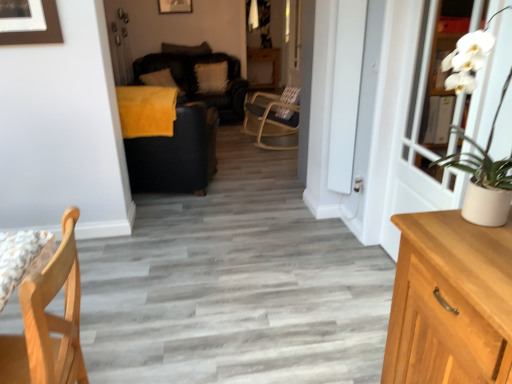
The width and height of the screenshot is (512, 384). Find the location of `white fluffy pillow at center, which is the first pillow in right-to-left order`. white fluffy pillow at center, which is the first pillow in right-to-left order is located at coordinates (211, 77).

Measure the distance between point (x=168, y=13) and camera.

Point (x=168, y=13) is 6.09 meters away from camera.

The image size is (512, 384). Find the location of `light wood chair at lower left`. light wood chair at lower left is located at coordinates (48, 321).

Find the location of `white wooden door at right`. white wooden door at right is located at coordinates (417, 148).

Where is `soft yellow pillow at upper center, placed as the 1th pillow when sorted from left to right`? soft yellow pillow at upper center, placed as the 1th pillow when sorted from left to right is located at coordinates point(161,80).

The image size is (512, 384). What do you see at coordinates (167, 140) in the screenshot?
I see `velvet black couch at center` at bounding box center [167, 140].

Image resolution: width=512 pixels, height=384 pixels. I want to click on white fluffy pillow at center, placed as the 3th pillow when sorted from left to right, so click(211, 77).

From a real-world perspective, is white wooden door at right above or below soft yellow pillow at upper center, placed as the 1th pillow when sorted from left to right?

From a real-world perspective, white wooden door at right is physically above soft yellow pillow at upper center, placed as the 1th pillow when sorted from left to right.

Considering the sizes of objects white wooden door at right and soft yellow pillow at upper center, the 3th pillow viewed from the right, in the image provided, who is smaller, white wooden door at right or soft yellow pillow at upper center, the 3th pillow viewed from the right,?

soft yellow pillow at upper center, the 3th pillow viewed from the right, is smaller.

From the picture: Is white wooden door at right facing away from soft yellow pillow at upper center, placed as the 1th pillow when sorted from left to right?

That's not correct — white wooden door at right is not looking away from soft yellow pillow at upper center, placed as the 1th pillow when sorted from left to right.

Is dark gray fabric pillow at upper center, the second pillow in the left-to-right sequence, outside of light wood chair at lower left?

Yes, dark gray fabric pillow at upper center, the second pillow in the left-to-right sequence, is located beyond the bounds of light wood chair at lower left.

Between dark gray fabric pillow at upper center, which appears as the second pillow when viewed from the right, and light wood chair at lower left, which one appears on the right side from the viewer's perspective?

From the viewer's perspective, light wood chair at lower left appears more on the right side.

Considering the points (186, 49) and (27, 344), which point is in front, point (186, 49) or point (27, 344)?

The point (27, 344) is closer to the camera.

From a real-world perspective, relative to dark gray fabric pillow at upper center, which appears as the second pillow when viewed from the right, is white fluffy pillow at center, which is the first pillow in right-to-left order, vertically above or below?

white fluffy pillow at center, which is the first pillow in right-to-left order, is situated lower than dark gray fabric pillow at upper center, which appears as the second pillow when viewed from the right, in the real world.

Are white fluffy pillow at center, which is the first pillow in right-to-left order, and dark gray fabric pillow at upper center, the second pillow in the left-to-right sequence, located far from each other?

No, there isn't a large distance between white fluffy pillow at center, which is the first pillow in right-to-left order, and dark gray fabric pillow at upper center, the second pillow in the left-to-right sequence.

Can you tell me how much white fluffy pillow at center, placed as the 3th pillow when sorted from left to right, and dark gray fabric pillow at upper center, which appears as the second pillow when viewed from the right, differ in facing direction?

The angular difference between white fluffy pillow at center, placed as the 3th pillow when sorted from left to right, and dark gray fabric pillow at upper center, which appears as the second pillow when viewed from the right, is 0.111 degrees.

From the image's perspective, which one is positioned lower, white fluffy pillow at center, which is the first pillow in right-to-left order, or dark gray fabric pillow at upper center, the second pillow in the left-to-right sequence?

white fluffy pillow at center, which is the first pillow in right-to-left order, from the image's perspective.

Considering the positions of objects white wooden door at right and dark gray fabric pillow at upper center, which appears as the second pillow when viewed from the right, in the image provided, who is behind, white wooden door at right or dark gray fabric pillow at upper center, which appears as the second pillow when viewed from the right,?

Positioned behind is dark gray fabric pillow at upper center, which appears as the second pillow when viewed from the right.

Is dark gray fabric pillow at upper center, the second pillow in the left-to-right sequence, a part of white wooden door at right?

No, dark gray fabric pillow at upper center, the second pillow in the left-to-right sequence, is located outside of white wooden door at right.

Does white wooden door at right have a larger size compared to dark gray fabric pillow at upper center, which appears as the second pillow when viewed from the right?

Yes.

Based on the photo, is white fluffy pillow at center, which is the first pillow in right-to-left order, at the right side of light wood chair at lower left?

Yes.

Can you tell me how much white fluffy pillow at center, which is the first pillow in right-to-left order, and light wood chair at lower left differ in facing direction?

They differ by 89.7 degrees in their facing directions.

In order to click on the 2nd pillow behind the light wood chair at lower left in this screenshot , I will do `click(211, 77)`.

How distant is white fluffy pillow at center, which is the first pillow in right-to-left order, from light wood chair at lower left?

The distance of white fluffy pillow at center, which is the first pillow in right-to-left order, from light wood chair at lower left is 5.03 meters.

From the image's perspective, is white wooden door at right above or below light wood chair at lower left?

From the image's perspective, white wooden door at right appears above light wood chair at lower left.

How far apart are white wooden door at right and light wood chair at lower left?

white wooden door at right and light wood chair at lower left are 6.14 feet apart.

Is white wooden door at right to the left or to the right of light wood chair at lower left in the image?

From the image, it's evident that white wooden door at right is to the right of light wood chair at lower left.

Find the location of a particular element. This screenshot has width=512, height=384. chair on the left of white wooden door at right is located at coordinates (48, 321).

Is light wood chair at lower left positioned with its back to white fluffy pillow at center, placed as the 3th pillow when sorted from left to right?

That's not correct — light wood chair at lower left is not looking away from white fluffy pillow at center, placed as the 3th pillow when sorted from left to right.

Can white fluffy pillow at center, placed as the 3th pillow when sorted from left to right, be found inside light wood chair at lower left?

No, white fluffy pillow at center, placed as the 3th pillow when sorted from left to right, is not inside light wood chair at lower left.

Who is smaller, light wood chair at lower left or white fluffy pillow at center, which is the first pillow in right-to-left order?

white fluffy pillow at center, which is the first pillow in right-to-left order.

Does light wood chair at lower left have a lesser width compared to white fluffy pillow at center, which is the first pillow in right-to-left order?

In fact, light wood chair at lower left might be wider than white fluffy pillow at center, which is the first pillow in right-to-left order.

The image size is (512, 384). What are the coordinates of `pillow that is the 1st object located above the white wooden door at right (from the image's perspective)` in the screenshot? It's located at (161, 80).

Where is `pillow that is the 3rd one when counting backward from the light wood chair at lower left`? The height and width of the screenshot is (384, 512). pillow that is the 3rd one when counting backward from the light wood chair at lower left is located at coordinates (186, 49).

From the image, which object appears to be nearer to white wooden door at right, white fluffy pillow at center, placed as the 3th pillow when sorted from left to right, or light wood chair at lower left?

The object closer to white wooden door at right is light wood chair at lower left.

Considering their positions, is white glossy screen door at right positioned further to light wood chair at lower left than white wooden door at right?

Among the two, white glossy screen door at right is located further to light wood chair at lower left.

Considering their positions, is dark gray fabric pillow at upper center, the second pillow in the left-to-right sequence, positioned further to soft yellow pillow at upper center, the 3th pillow viewed from the right, than white glossy screen door at right?

white glossy screen door at right is positioned further to the anchor soft yellow pillow at upper center, the 3th pillow viewed from the right.

Considering their positions, is dark gray fabric pillow at upper center, the second pillow in the left-to-right sequence, positioned closer to white glossy screen door at right than velvet black couch at center?

velvet black couch at center is positioned closer to the anchor white glossy screen door at right.

Estimate the real-world distances between objects in this image. Which object is further from velvet black couch at center, light wood chair at lower left or wooden picture frame at upper center?

Based on the image, wooden picture frame at upper center appears to be further to velvet black couch at center.

Which object lies nearer to the anchor point dark gray fabric pillow at upper center, which appears as the second pillow when viewed from the right, white fluffy pillow at center, placed as the 3th pillow when sorted from left to right, or light wood chair at lower left?

Based on the image, white fluffy pillow at center, placed as the 3th pillow when sorted from left to right, appears to be nearer to dark gray fabric pillow at upper center, which appears as the second pillow when viewed from the right.

Which object lies nearer to the anchor point velvet black couch at center, light wood chair at lower left or white fluffy pillow at center, which is the first pillow in right-to-left order?

light wood chair at lower left.

Looking at the image, which one is located closer to white wooden door at right, soft yellow pillow at upper center, the 3th pillow viewed from the right, or white glossy screen door at right?

Among the two, white glossy screen door at right is located nearer to white wooden door at right.

Image resolution: width=512 pixels, height=384 pixels. Find the location of `screen door located between light wood chair at lower left and velvet black couch at center in the depth direction`. screen door located between light wood chair at lower left and velvet black couch at center in the depth direction is located at coordinates click(354, 104).

The height and width of the screenshot is (384, 512). What are the coordinates of `studio couch located between white wooden door at right and white fluffy pillow at center, which is the first pillow in right-to-left order, in the depth direction` in the screenshot? It's located at (167, 140).

In order to click on studio couch between light wood chair at lower left and wooden picture frame at upper center in the front-back direction in this screenshot , I will do `click(167, 140)`.

Where is `pillow positioned between white glossy screen door at right and white fluffy pillow at center, which is the first pillow in right-to-left order, from near to far`? The height and width of the screenshot is (384, 512). pillow positioned between white glossy screen door at right and white fluffy pillow at center, which is the first pillow in right-to-left order, from near to far is located at coordinates (161, 80).